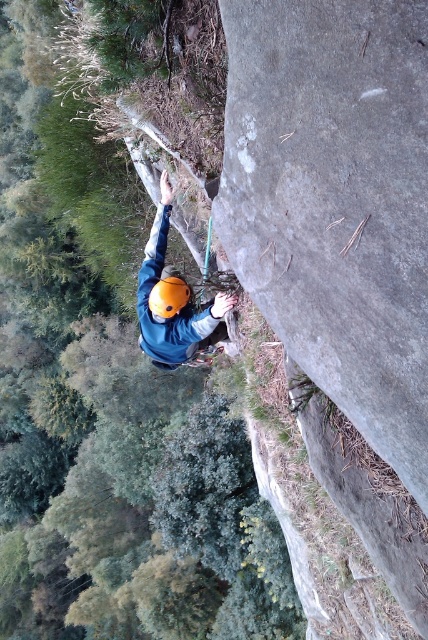
Question: Is the position of matte blue jacket at center less distant than that of orange matte helmet at center?

Choices:
 (A) yes
 (B) no

Answer: (A)

Question: Among these objects, which one is nearest to the camera?

Choices:
 (A) matte blue jacket at center
 (B) orange matte helmet at center

Answer: (A)

Question: Observing the image, what is the correct spatial positioning of matte blue jacket at center in reference to orange matte helmet at center?

Choices:
 (A) above
 (B) below

Answer: (A)

Question: Does matte blue jacket at center appear over orange matte helmet at center?

Choices:
 (A) no
 (B) yes

Answer: (B)

Question: Which point is closer to the camera?

Choices:
 (A) (158, 307)
 (B) (158, 212)

Answer: (A)